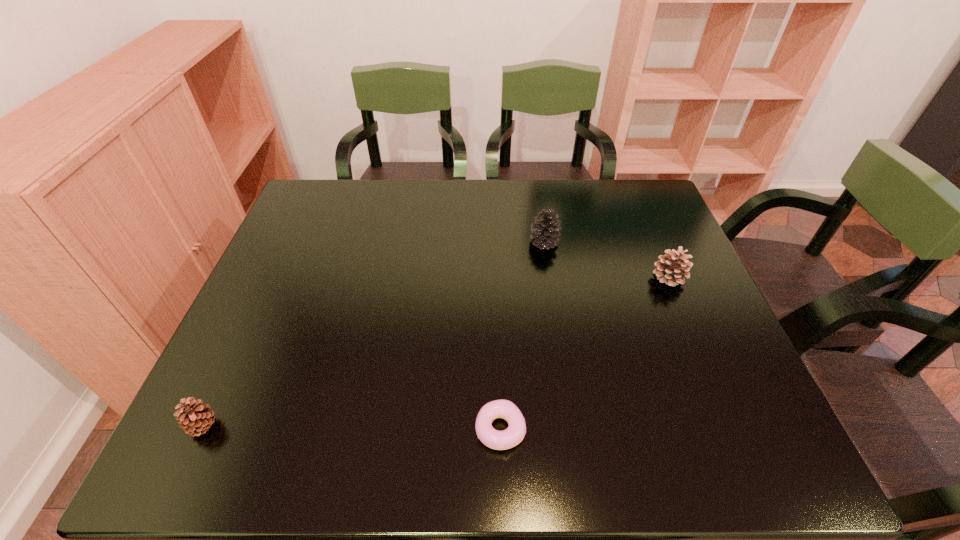
Locate an element on the screen. This screenshot has width=960, height=540. free space between the second pinecone from right to left and the second object from left to right is located at coordinates (522, 336).

Locate an element on the screen. This screenshot has width=960, height=540. vacant region between the shortest object and the leftmost object is located at coordinates (352, 428).

The width and height of the screenshot is (960, 540). I want to click on vacant space that's between the farthest pinecone and the leftmost object, so click(373, 334).

Select which object appears as the second closest to the doughnut. Please provide its 2D coordinates. Your answer should be formatted as a tuple, i.e. [(x, y)], where the tuple contains the x and y coordinates of a point satisfying the conditions above.

[(670, 269)]

Where is `object that stands as the third closest to the shortest object`? object that stands as the third closest to the shortest object is located at coordinates (195, 419).

Identify which pinecone is the second nearest to the leftmost pinecone. Please provide its 2D coordinates. Your answer should be formatted as a tuple, i.e. [(x, y)], where the tuple contains the x and y coordinates of a point satisfying the conditions above.

[(670, 269)]

The width and height of the screenshot is (960, 540). What are the coordinates of `pinecone that is the closest to the second pinecone from left to right` in the screenshot? It's located at (670, 269).

The width and height of the screenshot is (960, 540). Identify the location of free space that satisfies the following two spatial constraints: 1. on the back side of the rightmost pinecone; 2. on the left side of the leftmost object. (274, 278).